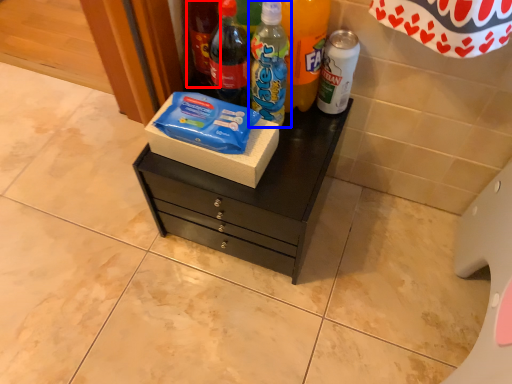
Question: Which point is closer to the camera, bottle (highlighted by a red box) or bottle (highlighted by a blue box)?

Choices:
 (A) bottle
 (B) bottle

Answer: (B)